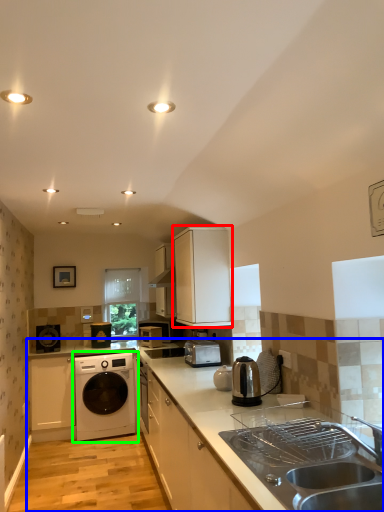
Question: Which object is the farthest from cabinetry (highlighted by a red box)? Choose among these: countertop (highlighted by a blue box) or washing machine (highlighted by a green box).

Choices:
 (A) countertop
 (B) washing machine

Answer: (B)